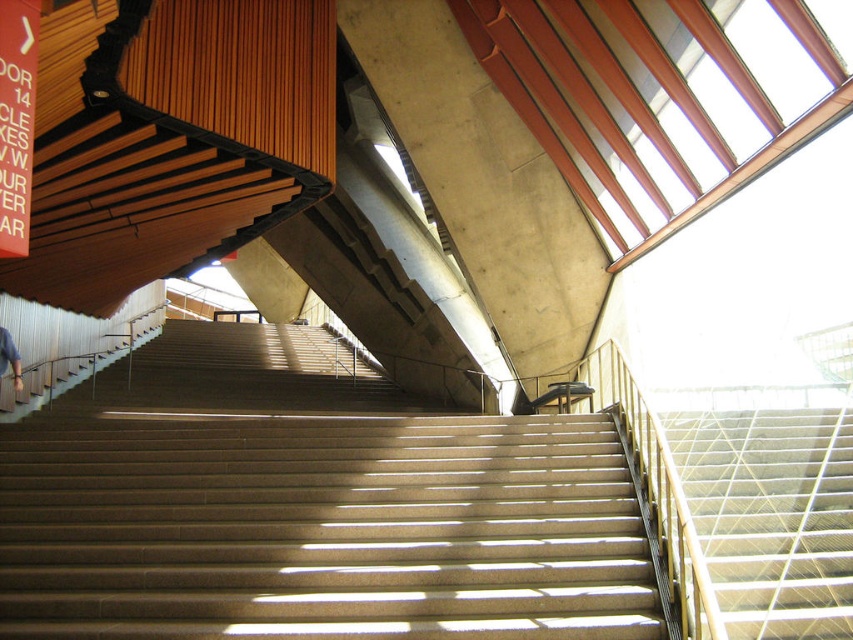
Can you confirm if brown concrete stairs at center is positioned to the right of blue denim jeans at lower left?

Yes, brown concrete stairs at center is to the right of blue denim jeans at lower left.

Which of these two, brown concrete stairs at center or blue denim jeans at lower left, stands shorter?

Standing shorter between the two is blue denim jeans at lower left.

Who is more distant from viewer, (428, 483) or (4, 355)?

Positioned behind is point (4, 355).

Locate an element on the screen. Image resolution: width=853 pixels, height=640 pixels. brown concrete stairs at center is located at coordinates (308, 508).

Who is more distant from viewer, (102, 624) or (786, 476)?

The point (786, 476) is behind.

Can you confirm if brown concrete stairs at center is positioned to the right of metallic silver stairs at center?

No, brown concrete stairs at center is not to the right of metallic silver stairs at center.

Locate an element on the screen. The width and height of the screenshot is (853, 640). brown concrete stairs at center is located at coordinates (308, 508).

Measure the distance between metallic silver stairs at center and camera.

16.85 feet

Which is more to the left, metallic silver stairs at center or blue denim jeans at lower left?

blue denim jeans at lower left is more to the left.

Measure the distance between metallic silver stairs at center and camera.

The distance of metallic silver stairs at center from camera is 16.85 feet.

Image resolution: width=853 pixels, height=640 pixels. What are the coordinates of `metallic silver stairs at center` in the screenshot? It's located at (770, 515).